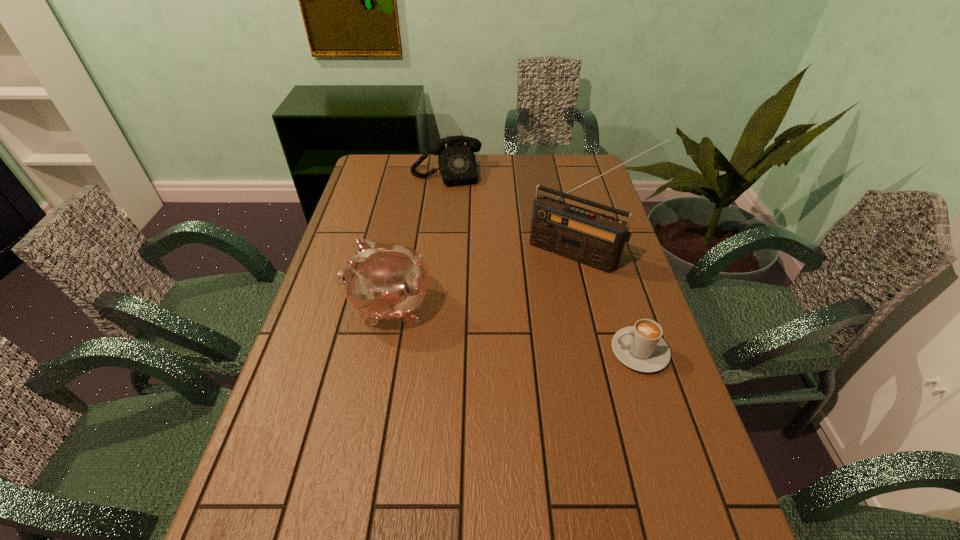
The height and width of the screenshot is (540, 960). I want to click on free space between the cappuccino and the piggy bank, so click(515, 329).

At what (x,y) coordinates should I click in order to perform the action: click on vacant area that lies between the second shortest object and the shortest object. Please return your answer as a coordinate pair (x, y). Looking at the image, I should click on (543, 262).

Identify the location of free space between the farthest object and the third shortest object. The width and height of the screenshot is (960, 540). (418, 240).

Where is `free space between the second tallest object and the third tallest object`? The height and width of the screenshot is (540, 960). free space between the second tallest object and the third tallest object is located at coordinates (418, 240).

This screenshot has width=960, height=540. Identify the location of free area in between the cappuccino and the radio receiver. (609, 302).

Where is `free spot between the shortest object and the radio receiver`? The width and height of the screenshot is (960, 540). free spot between the shortest object and the radio receiver is located at coordinates click(609, 302).

At what (x,y) coordinates should I click in order to perform the action: click on object that can be found as the third closest to the second shortest object. Please return your answer as a coordinate pair (x, y). The image size is (960, 540). Looking at the image, I should click on (640, 347).

Find the location of a particular element. object that is the third closest one to the farthest object is located at coordinates (640, 347).

Identify the location of free space that satisfies the following two spatial constraints: 1. on the front side of the shortest object; 2. to the right of the tallest object. The width and height of the screenshot is (960, 540). (602, 351).